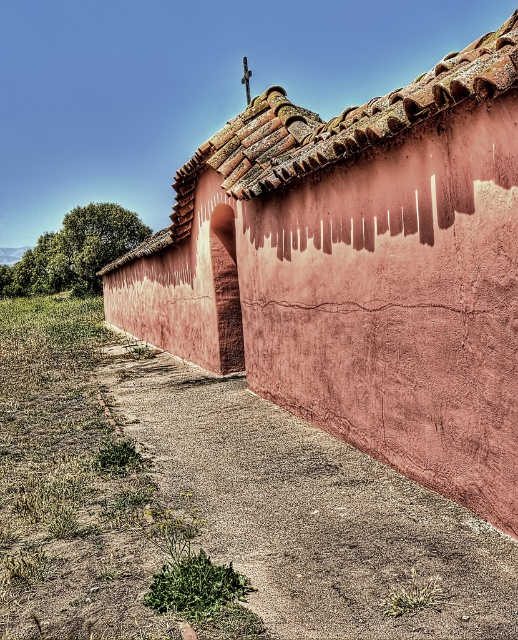
You are standing in front of a rustic building with a reddish pink adobe wall and a terracotta roof. There is a small cross on top of the roof. You notice a point marked at coordinate (357,269). What is located at this coordinate?

The point at coordinate (357,269) marks the location of the matte clay hut at center.

Based on the photo, you are standing outside the building and want to enter through the archway. Which object, the matte clay hut at center or the brown clay tiles at upper center, is closer to you as you approach the entrance?

The matte clay hut at center is closer to you as you approach the entrance because it is in front of the brown clay tiles at upper center.